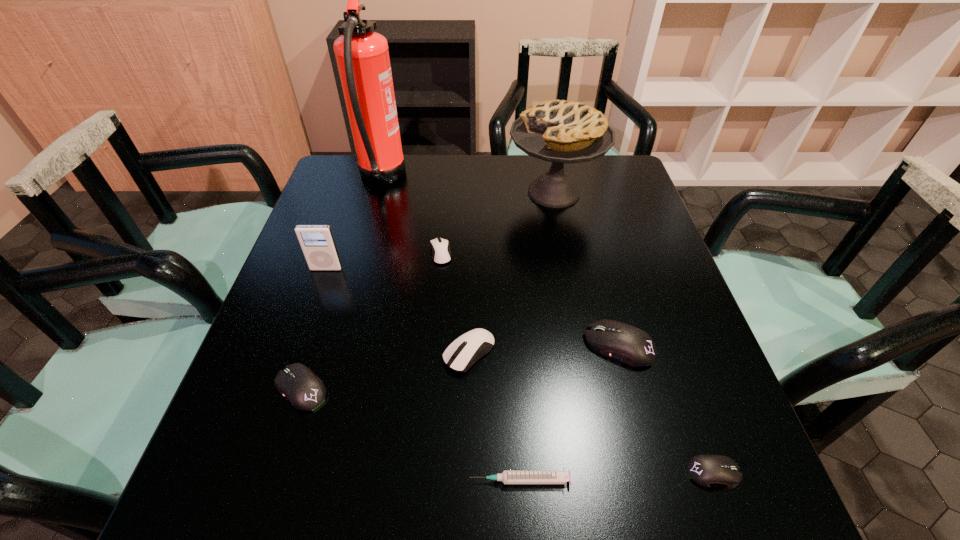
What are the coordinates of `empty space between the red fire extinguisher and the iPod` in the screenshot? It's located at (354, 224).

At what (x,y) coordinates should I click in order to perform the action: click on unoccupied area between the fourth farthest object and the smaller white mouse. Please return your answer as a coordinate pair (x, y). This screenshot has width=960, height=540. Looking at the image, I should click on (383, 261).

Identify the location of blank region between the farthest computer equipment and the nearest black computer equipment. This screenshot has height=540, width=960. (577, 363).

You are a GUI agent. You are given a task and a screenshot of the screen. Output one action in this format:
    pyautogui.click(x=<x>, y=<y>)
    Task: Click on the vacant area that lies between the pie and the white syringe
    Image resolution: width=960 pixels, height=540 pixels.
    Given the screenshot: What is the action you would take?
    pyautogui.click(x=537, y=336)

Where is `object identified as the fourth closest to the red fire extinguisher`? The height and width of the screenshot is (540, 960). object identified as the fourth closest to the red fire extinguisher is located at coordinates (468, 348).

Choose which object is the seventh nearest neighbor to the white syringe. Please provide its 2D coordinates. Your answer should be formatted as a tuple, i.e. [(x, y)], where the tuple contains the x and y coordinates of a point satisfying the conditions above.

[(558, 131)]

Point out which computer equipment is positioned as the second nearest to the second tallest object. Please provide its 2D coordinates. Your answer should be formatted as a tuple, i.e. [(x, y)], where the tuple contains the x and y coordinates of a point satisfying the conditions above.

[(628, 344)]

Where is `computer equipment that stands as the third closest to the syringe`? The height and width of the screenshot is (540, 960). computer equipment that stands as the third closest to the syringe is located at coordinates (628, 344).

You are a GUI agent. You are given a task and a screenshot of the screen. Output one action in this format:
    pyautogui.click(x=<x>, y=<y>)
    Task: Click on the black computer equipment that is the closest to the white syringe
    
    Given the screenshot: What is the action you would take?
    pyautogui.click(x=706, y=470)

Find the location of a particular element. The image size is (960, 540). black computer equipment identified as the second closest to the leftmost black computer equipment is located at coordinates (706, 470).